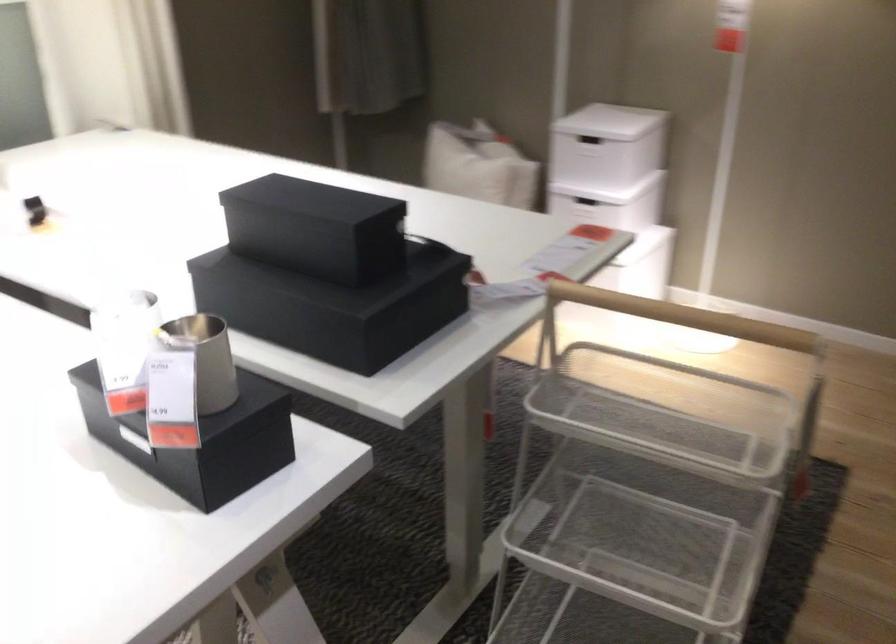
The location [170,399] corresponds to which object?

It refers to a white catalog.